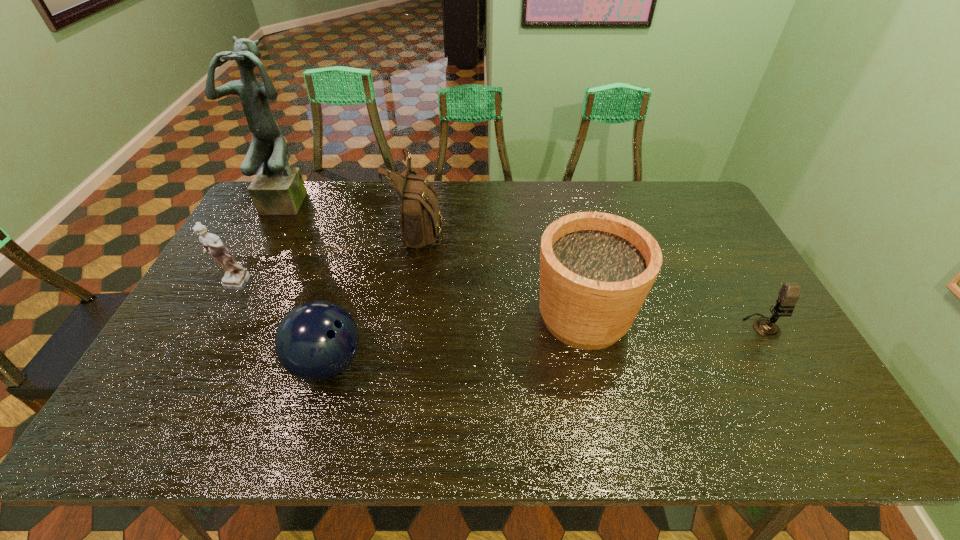
The width and height of the screenshot is (960, 540). In order to click on the tallest object in this screenshot , I will do `click(277, 189)`.

Image resolution: width=960 pixels, height=540 pixels. What are the coordinates of `shoulder bag` in the screenshot? It's located at (421, 220).

Identify the location of the second object from right to left. (596, 269).

Find the location of `figurine`. figurine is located at coordinates pos(236,277).

I want to click on bowling ball, so click(x=315, y=341).

Where is `microphone`? This screenshot has height=540, width=960. microphone is located at coordinates (789, 293).

Find the location of `the rightmost object`. the rightmost object is located at coordinates (789, 293).

The width and height of the screenshot is (960, 540). What are the coordinates of `vacant region located 0.370m on the face of the tallest object` in the screenshot? It's located at (241, 296).

Identify the location of vacant region located 0.210m on the front-facing side of the shoulder bag. click(x=507, y=228).

Identify the location of vacant region located on the back of the flowerpot. (568, 247).